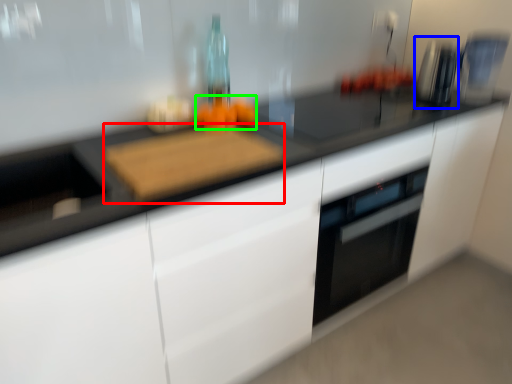
Question: Considering the real-world distances, which object is farthest from cutting board (highlighted by a red box)? appliance (highlighted by a blue box) or food (highlighted by a green box)?

Choices:
 (A) appliance
 (B) food

Answer: (A)